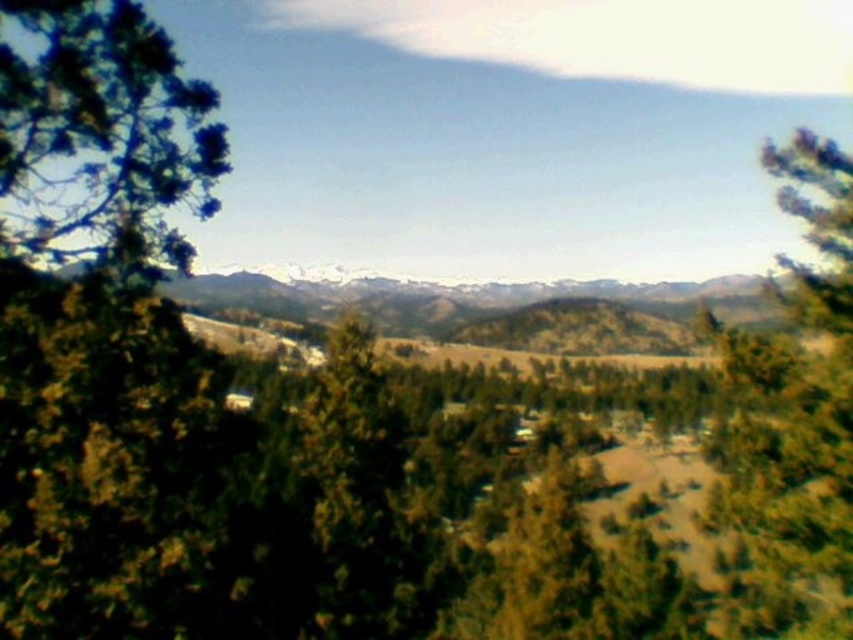
What are the coordinates of `green leafy tree at left` in the screenshot? It's located at (99, 131).

Is point (80, 33) positioned behind point (804, 470)?

No.

Is point (148, 125) farther from camera compared to point (827, 253)?

No, (148, 125) is in front of (827, 253).

Identify the location of green leafy tree at left. (99, 131).